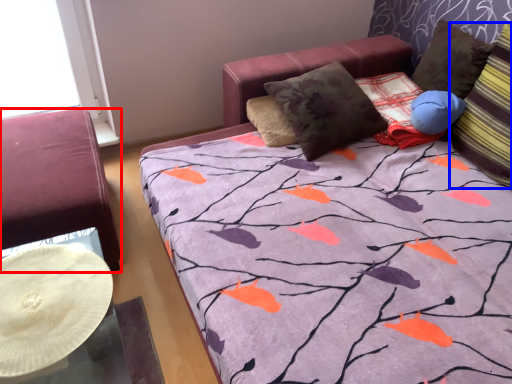
Question: Among these objects, which one is farthest to the camera, furniture (highlighted by a red box) or pillow (highlighted by a blue box)?

Choices:
 (A) furniture
 (B) pillow

Answer: (A)